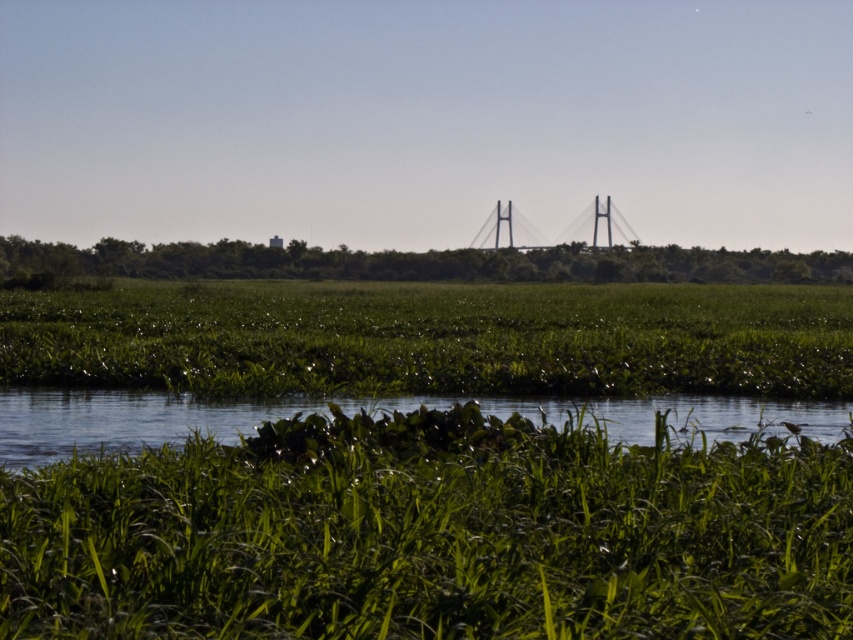
You are a hiker who wants to take a photo of the metallic gray suspension bridge at center without any obstructions. Are the green leafy grass at center blocking your view of the bridge?

The green leafy grass at center is not as tall as the metallic gray suspension bridge at center, so the grass will not block the view of the bridge.

You are standing at the edge of the green grassy field at upper center and want to walk to the clear water at center. Which direction should you head towards?

The clear water at center is positioned on the left side of green grassy field at upper center, so you should head towards the left to reach it.